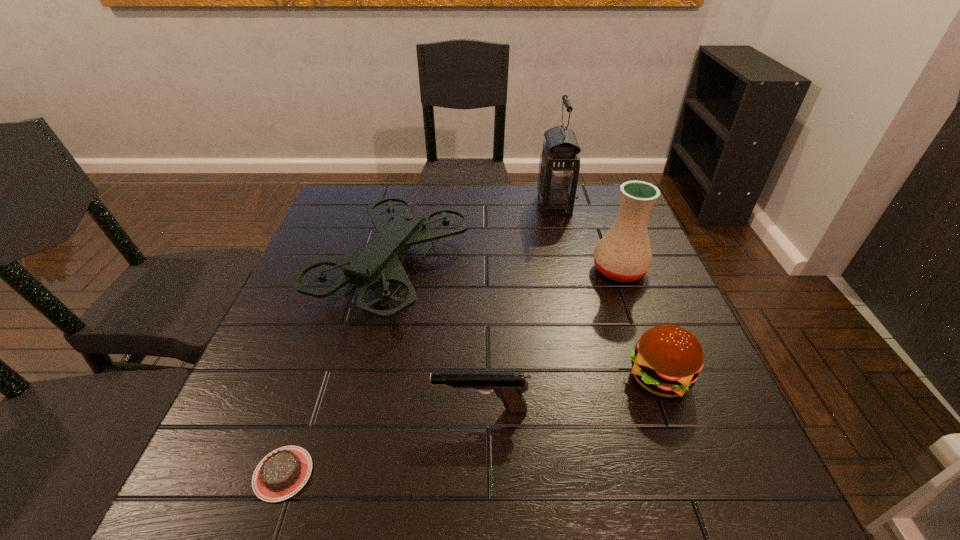
This screenshot has height=540, width=960. I want to click on lantern, so click(x=559, y=165).

The image size is (960, 540). What are the coordinates of `the farthest object` in the screenshot? It's located at (559, 165).

Locate an element on the screen. pottery is located at coordinates (624, 254).

You are a GUI agent. You are given a task and a screenshot of the screen. Output one action in this format:
    pyautogui.click(x=<x>, y=<y>)
    Task: Click on the drone
    The image size is (960, 540).
    Given the screenshot: What is the action you would take?
    pyautogui.click(x=379, y=262)

This screenshot has height=540, width=960. Find the location of `hamburger`. hamburger is located at coordinates pyautogui.click(x=667, y=360).

Find the location of a particular element. This screenshot has height=540, width=960. pistol is located at coordinates (509, 387).

Identify the location of the shortest object. Image resolution: width=960 pixels, height=540 pixels. (282, 473).

Identify the location of chocolate cake. (282, 473).

The width and height of the screenshot is (960, 540). What are the coordinates of `vacant space located on the front-facing side of the lantern` in the screenshot? It's located at (462, 205).

You are a GUI agent. You are given a task and a screenshot of the screen. Output one action in this format:
    pyautogui.click(x=<x>, y=<y>)
    Task: Click on the vacant space located on the front-facing side of the lantern
    
    Given the screenshot: What is the action you would take?
    pyautogui.click(x=436, y=205)